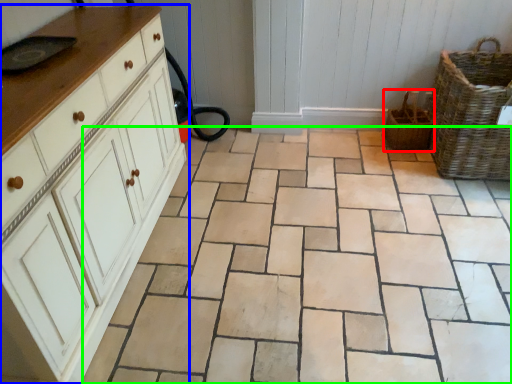
Question: Which object is the closest to the basket (highlighted by a red box)? Choose among these: chest of drawers (highlighted by a blue box) or ceramic tile (highlighted by a green box).

Choices:
 (A) chest of drawers
 (B) ceramic tile

Answer: (B)